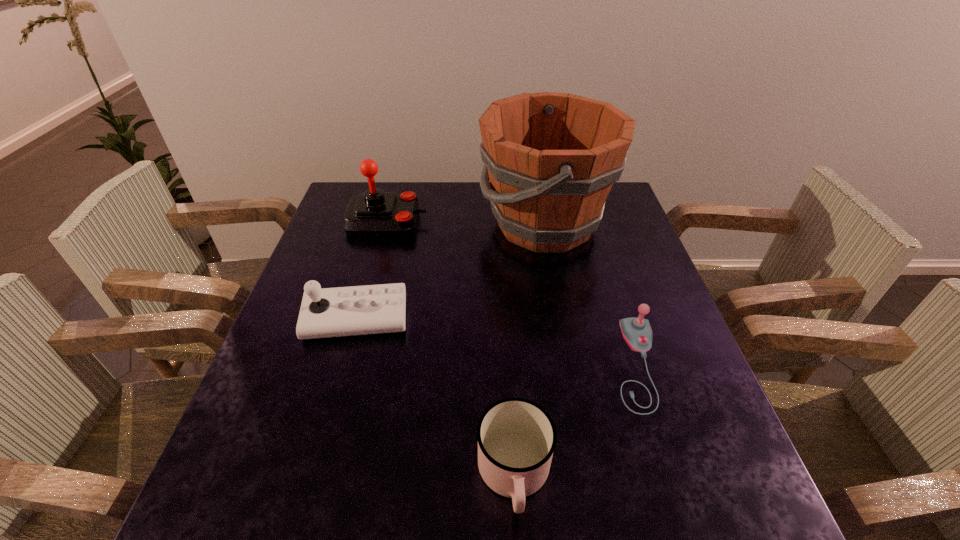
At what (x,y) coordinates should I click in order to perform the action: click on vacant area that lies between the second shortest joystick and the mug. Please return your answer as a coordinate pair (x, y). Looking at the image, I should click on (435, 397).

Where is `free point between the tallest object and the mug`? Image resolution: width=960 pixels, height=540 pixels. free point between the tallest object and the mug is located at coordinates (530, 349).

The image size is (960, 540). I want to click on free space between the mug and the rightmost joystick, so click(575, 420).

The image size is (960, 540). What are the coordinates of `free space between the shortest joystick and the nearest object` in the screenshot? It's located at (575, 420).

Choose which object is the fourth nearest neighbor to the rightmost joystick. Please provide its 2D coordinates. Your answer should be formatted as a tuple, i.e. [(x, y)], where the tuple contains the x and y coordinates of a point satisfying the conditions above.

[(373, 213)]

Find the location of a particular element. The height and width of the screenshot is (540, 960). object identified as the fourth closest to the tallest object is located at coordinates (516, 437).

You are a GUI agent. You are given a task and a screenshot of the screen. Output one action in this format:
    pyautogui.click(x=<x>, y=<y>)
    Task: Click on the joystick object that ranks as the closest to the second tallest joystick
    This screenshot has width=960, height=540.
    Given the screenshot: What is the action you would take?
    pyautogui.click(x=373, y=213)

You are a GUI agent. You are given a task and a screenshot of the screen. Output one action in this format:
    pyautogui.click(x=<x>, y=<y>)
    Task: Click on the closest joystick to the bucket
    
    Given the screenshot: What is the action you would take?
    pyautogui.click(x=373, y=213)

This screenshot has height=540, width=960. Identify the location of vacant space that satisfies the following two spatial constraints: 1. on the handle side of the tallest object; 2. on the side of the mug with the handle. (591, 475).

Where is `blank space that satisfies the following two spatial constraints: 1. on the handle side of the bucket; 2. on the side of the mug with the handle`? This screenshot has height=540, width=960. blank space that satisfies the following two spatial constraints: 1. on the handle side of the bucket; 2. on the side of the mug with the handle is located at coordinates (591, 475).